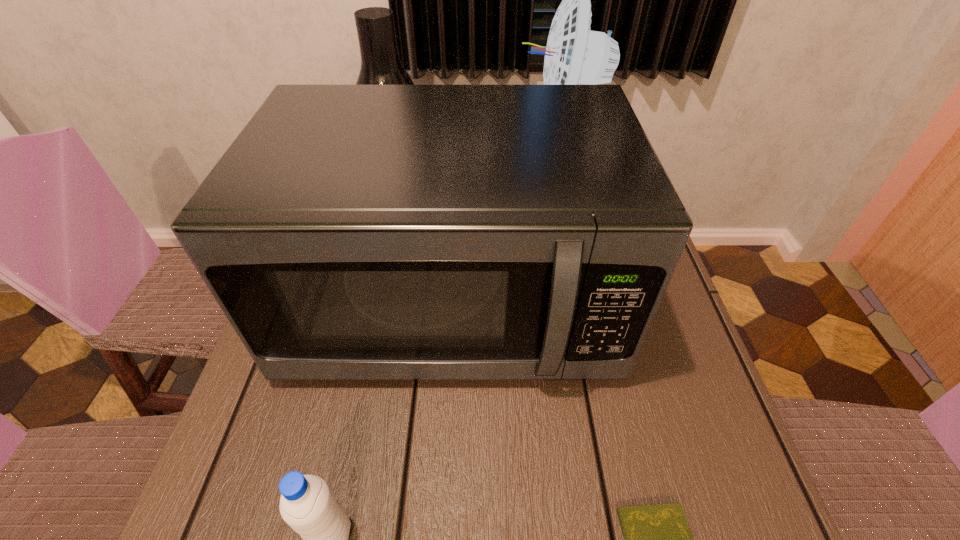
At what (x,y) coordinates should I click in order to perform the action: click on fan. Please return your answer as a coordinate pair (x, y). Image resolution: width=960 pixels, height=540 pixels. Looking at the image, I should click on (574, 55).

I want to click on oil lamp, so coord(380,64).

The width and height of the screenshot is (960, 540). In order to click on the third farthest object in this screenshot , I will do `click(350, 232)`.

Where is `vacant space located on the grille of the fan`? vacant space located on the grille of the fan is located at coordinates (382, 143).

Find the location of `vacant space located on the grille of the fan`. vacant space located on the grille of the fan is located at coordinates (382, 143).

Identify the location of free space located 0.330m on the grille of the fan. (402, 143).

You are a GUI agent. You are given a task and a screenshot of the screen. Output one action in this format:
    pyautogui.click(x=<x>, y=<y>)
    Task: Click on the blank area located on the back of the oil lamp
    This screenshot has width=960, height=540.
    Given the screenshot: What is the action you would take?
    pyautogui.click(x=412, y=113)

I want to click on vacant space located on the front-facing side of the third nearest object, so click(x=443, y=473).

What are the coordinates of `object situated at the far edge` in the screenshot? It's located at (574, 55).

Where is `oil lamp present at the left edge`? The image size is (960, 540). oil lamp present at the left edge is located at coordinates (380, 64).